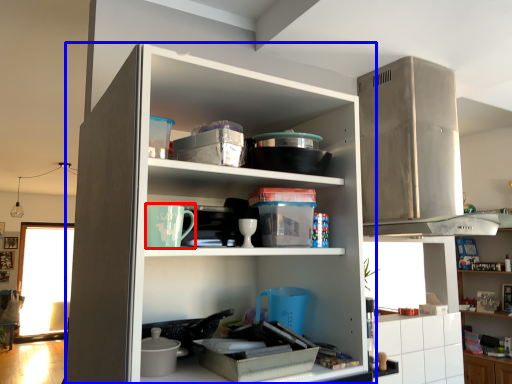
Question: Which object appears farthest to the camera in this image, appliance (highlighted by a red box) or cupboard (highlighted by a blue box)?

Choices:
 (A) appliance
 (B) cupboard

Answer: (A)